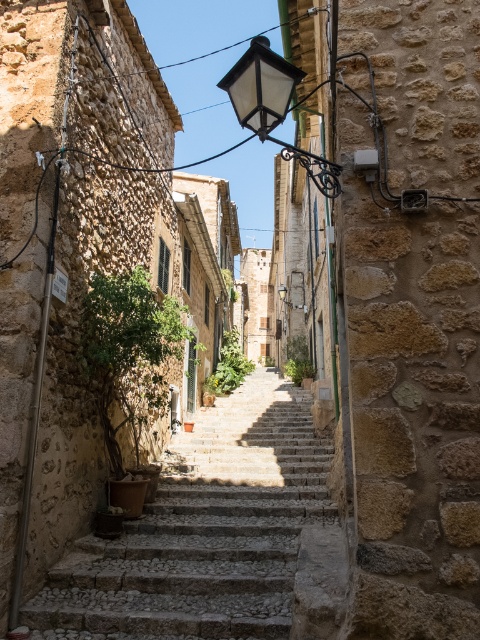
Question: Is stone textured stairs at center behind matte glass streetlamp at upper center?

Choices:
 (A) yes
 (B) no

Answer: (A)

Question: Which object appears closest to the camera in this image?

Choices:
 (A) stone textured stairs at center
 (B) matte glass streetlamp at upper center

Answer: (B)

Question: Can you confirm if stone textured stairs at center is positioned to the left of matte glass streetlamp at upper center?

Choices:
 (A) yes
 (B) no

Answer: (B)

Question: Is stone textured stairs at center above matte glass streetlamp at upper center?

Choices:
 (A) yes
 (B) no

Answer: (B)

Question: Which object appears farthest from the camera in this image?

Choices:
 (A) matte glass streetlamp at upper center
 (B) stone textured stairs at center

Answer: (B)